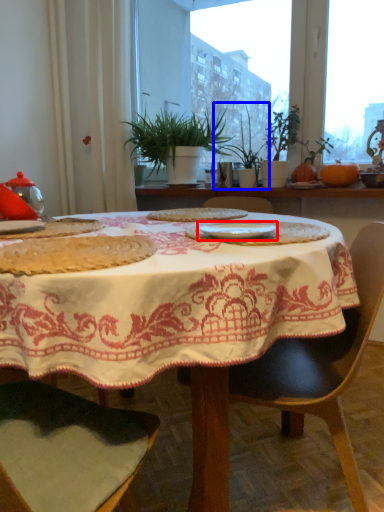
Question: Among these objects, which one is nearest to the camera, tableware (highlighted by a red box) or houseplant (highlighted by a blue box)?

Choices:
 (A) tableware
 (B) houseplant

Answer: (A)